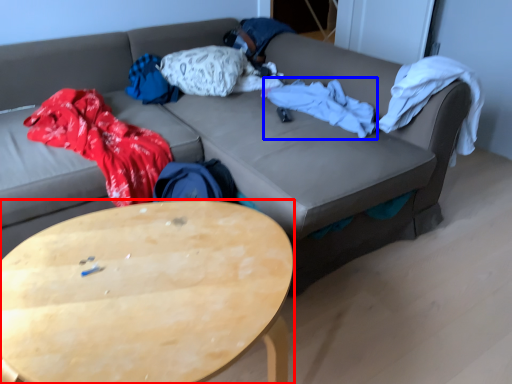
Question: Which object is further to the camera taking this photo, coffee table (highlighted by a red box) or blanket (highlighted by a blue box)?

Choices:
 (A) coffee table
 (B) blanket

Answer: (B)